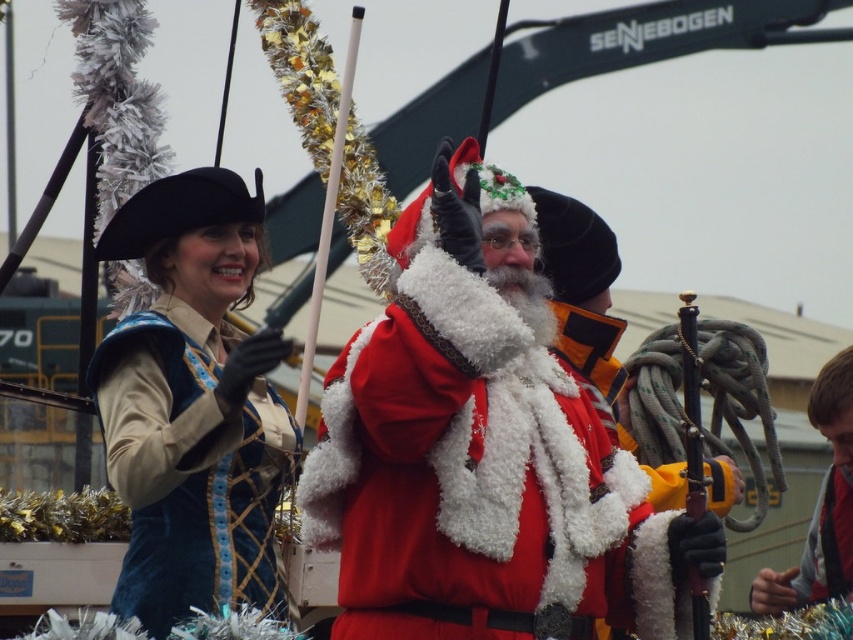
Question: Which is farther from the fuzzy red santa at center?

Choices:
 (A) velvet blue dress at left
 (B) red fabric jacket at lower right

Answer: (B)

Question: Among these points, which one is farthest from the camera?

Choices:
 (A) (827, 524)
 (B) (393, 593)

Answer: (A)

Question: Is fuzzy red santa at center above red fabric jacket at lower right?

Choices:
 (A) no
 (B) yes

Answer: (B)

Question: Can you confirm if fuzzy red santa at center is positioned above velvet blue dress at left?

Choices:
 (A) yes
 (B) no

Answer: (B)

Question: Based on their relative distances, which object is nearer to the fuzzy red santa at center?

Choices:
 (A) red fabric jacket at lower right
 (B) velvet blue dress at left

Answer: (B)

Question: From the image, what is the correct spatial relationship of fuzzy red santa at center in relation to red fabric jacket at lower right?

Choices:
 (A) left
 (B) right

Answer: (A)